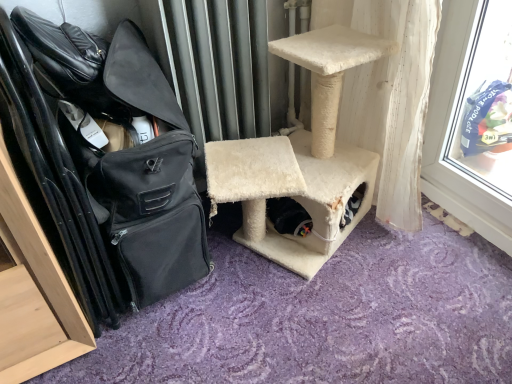
Where is `free location in front of beige carpeted cat tree at center`? The width and height of the screenshot is (512, 384). free location in front of beige carpeted cat tree at center is located at coordinates (316, 326).